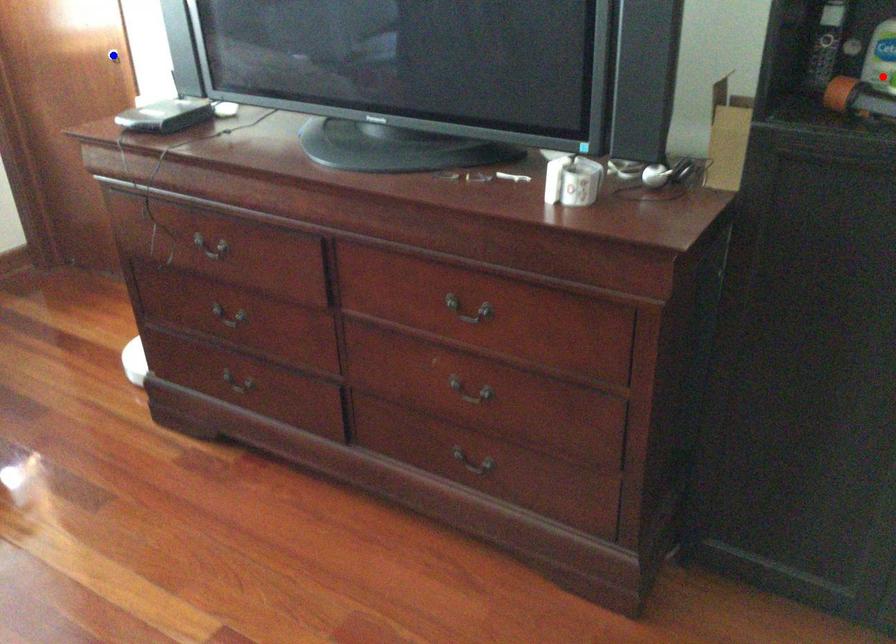
Question: In the image, two points are highlighted. Which point is nearer to the camera? Reply with the corresponding letter.

Choices:
 (A) blue point
 (B) red point

Answer: (B)